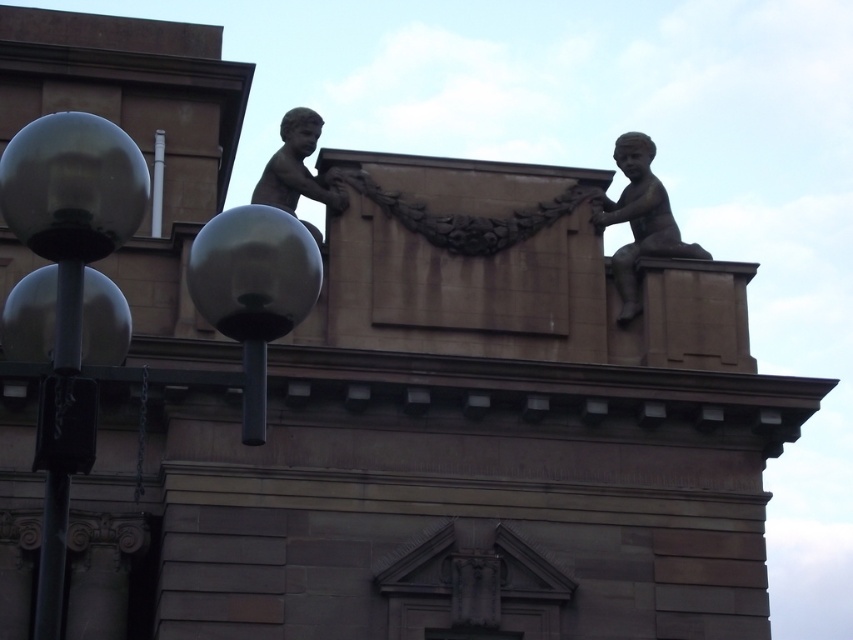
Does metallic gray sphere at left appear on the right side of bronze statue at upper right?

No, metallic gray sphere at left is not to the right of bronze statue at upper right.

Is point (61, 566) behind point (656, 224)?

No.

The image size is (853, 640). I want to click on metallic gray sphere at left, so click(65, 296).

In order to click on metallic gray sphere at left in this screenshot , I will do `click(65, 296)`.

Which is below, metallic gray pole at left or bronze statue at upper center?

metallic gray pole at left is below.

Who is positioned more to the left, metallic gray pole at left or bronze statue at upper center?

Positioned to the left is metallic gray pole at left.

Does point (51, 572) come behind point (341, 196)?

No, it is not.

The width and height of the screenshot is (853, 640). I want to click on metallic gray pole at left, so click(51, 556).

Who is more forward, [207,237] or [70,284]?

Point [70,284]

Is matte black sphere at center taller than metallic gray pole at left?

In fact, matte black sphere at center may be shorter than metallic gray pole at left.

Image resolution: width=853 pixels, height=640 pixels. What do you see at coordinates (253, 289) in the screenshot? I see `matte black sphere at center` at bounding box center [253, 289].

At what (x,y) coordinates should I click in order to perform the action: click on matte black sphere at center. Please return your answer as a coordinate pair (x, y). Looking at the image, I should click on click(x=253, y=289).